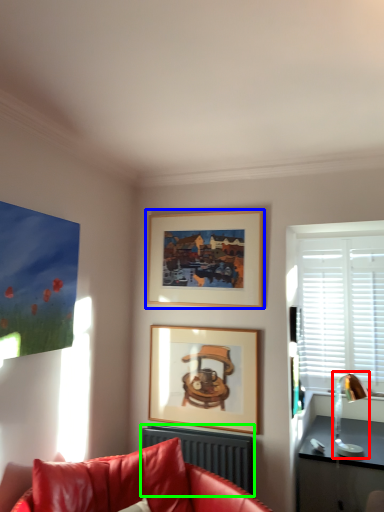
Question: Which is nearer to the lamp (highlighted by a red box)? picture frame (highlighted by a blue box) or radiator (highlighted by a green box).

Choices:
 (A) picture frame
 (B) radiator

Answer: (B)